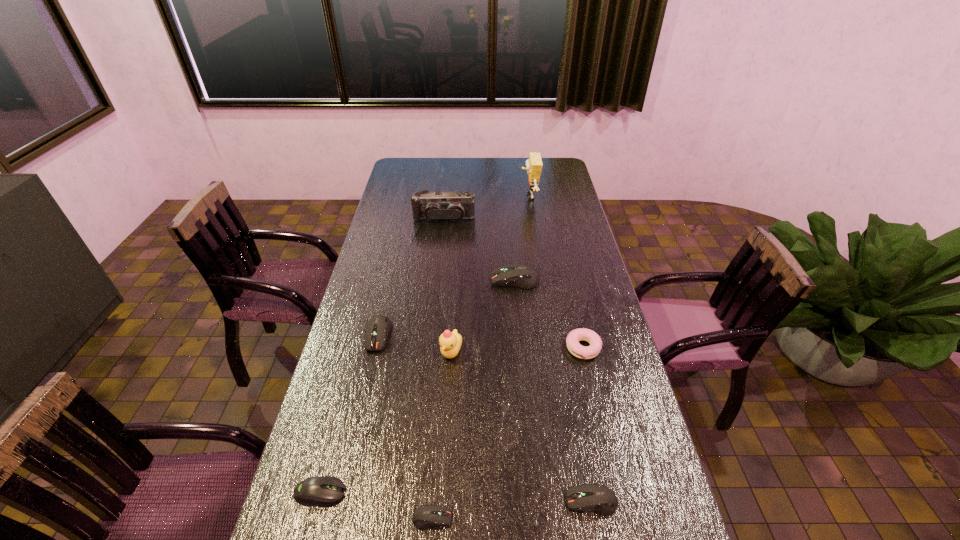
Where is `doughnut`? The height and width of the screenshot is (540, 960). doughnut is located at coordinates (575, 348).

Where is `the third biggest dark computer equipment`? Image resolution: width=960 pixels, height=540 pixels. the third biggest dark computer equipment is located at coordinates (596, 498).

The image size is (960, 540). I want to click on gray computer mouse, so click(x=321, y=490).

Where is `the smallest dark computer equipment`? the smallest dark computer equipment is located at coordinates (425, 516).

Identify the location of the shortest object. Image resolution: width=960 pixels, height=540 pixels. (425, 516).

Where is `free space located 0.320m on the face of the yellow sponge`? free space located 0.320m on the face of the yellow sponge is located at coordinates (451, 197).

Locate an element on the screen. This screenshot has width=960, height=540. vacant area located 0.310m on the face of the yellow sponge is located at coordinates (454, 197).

Identify the location of free space located on the face of the yellow sponge. This screenshot has height=540, width=960. (473, 197).

Image resolution: width=960 pixels, height=540 pixels. I want to click on vacant space positioned 0.090m on the front-facing side of the camcorder, so click(442, 238).

This screenshot has width=960, height=540. What are the coordinates of `vacant region located on the front-facing side of the seventh shortest object` in the screenshot? It's located at (449, 382).